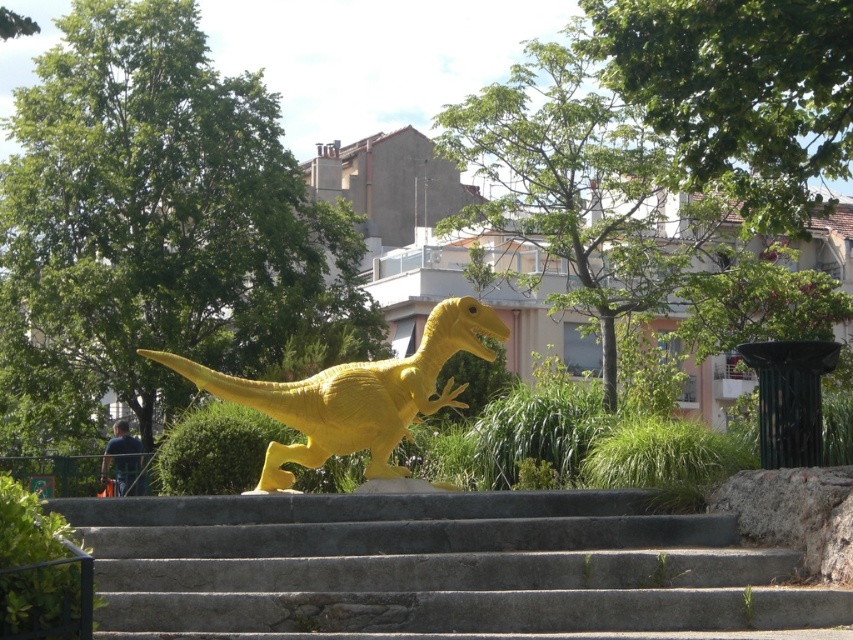
You are a park visitor who wants to take a photo of the matte yellow dinosaur at center. You are standing at the bottom of the gray concrete stairs at center. Which object is closer to you, the dinosaur or the stairs?

The gray concrete stairs at center are closer to you since you are standing at the bottom of them, while the matte yellow dinosaur at center is positioned at the top of the stairs.

You are a maintenance worker assessing the park layout. The city requires that all statues must be at least 2 meters tall to qualify for historical preservation. If the gray concrete stairs at center are 1.2 meters tall, can the matte yellow dinosaur at center qualify for preservation?

The gray concrete stairs at center has a lesser height compared to matte yellow dinosaur at center. Since the stairs are 1.2 meters tall, the dinosaur must be taller than 1.2 meters. However, we don not know the exact height of the dinosaur. Therefore, it is uncertain whether the matte yellow dinosaur at center qualifies for preservation without additional measurements.